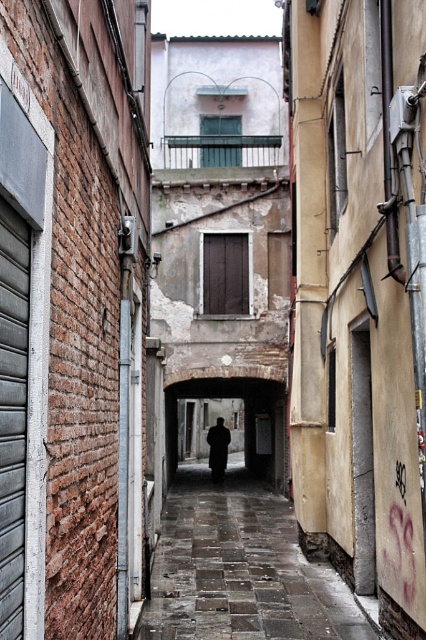
You are standing in the middle of the alleyway and notice a dark gray stone path at center and a dark wool coat at center. Which object is closer to the ground?

The dark gray stone path at center is closer to the ground because it is positioned below the dark wool coat at center.